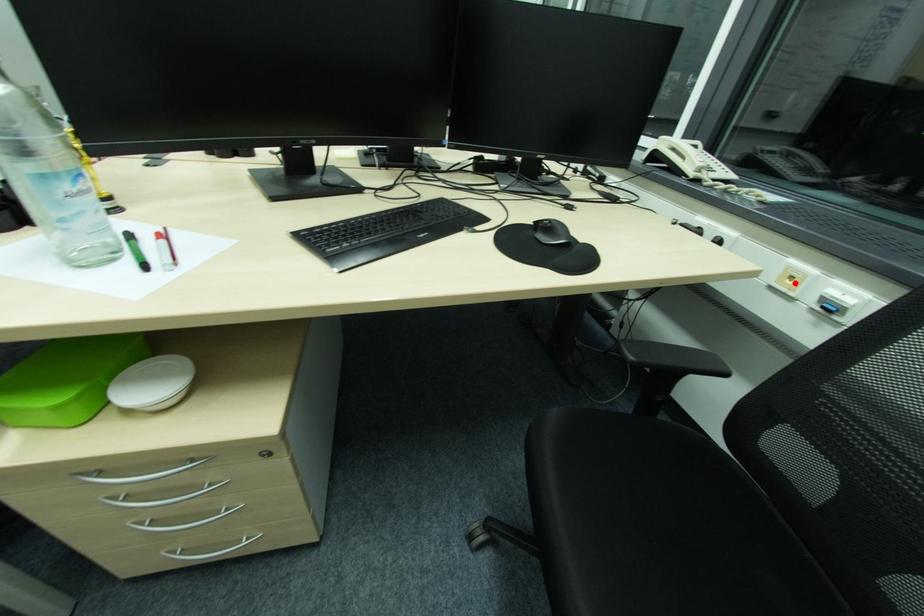
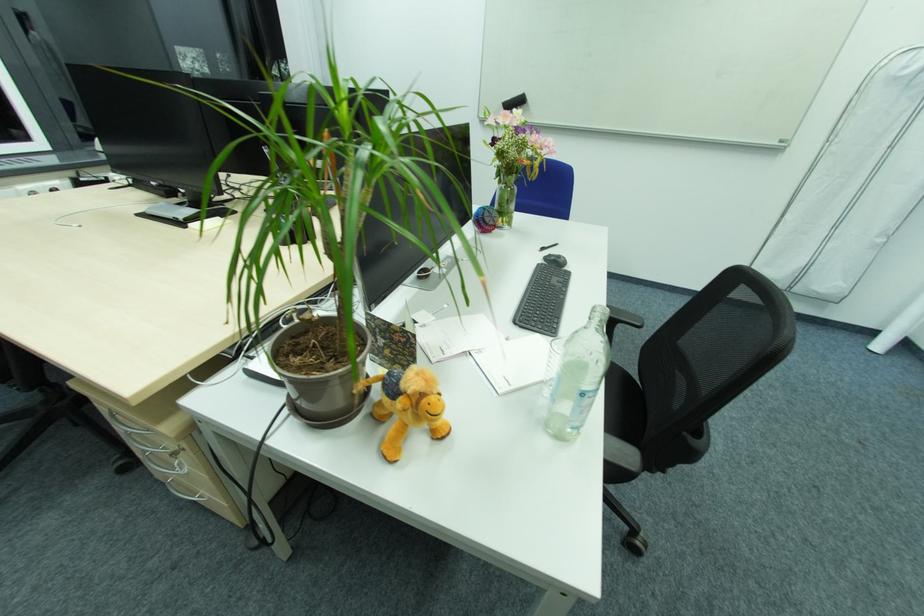
Question: I am providing you with two images of the same scene from different viewpoints. A red point is marked on the first image. Can you still see the location of the red point in image 2?

Choices:
 (A) Yes
 (B) No

Answer: (B)